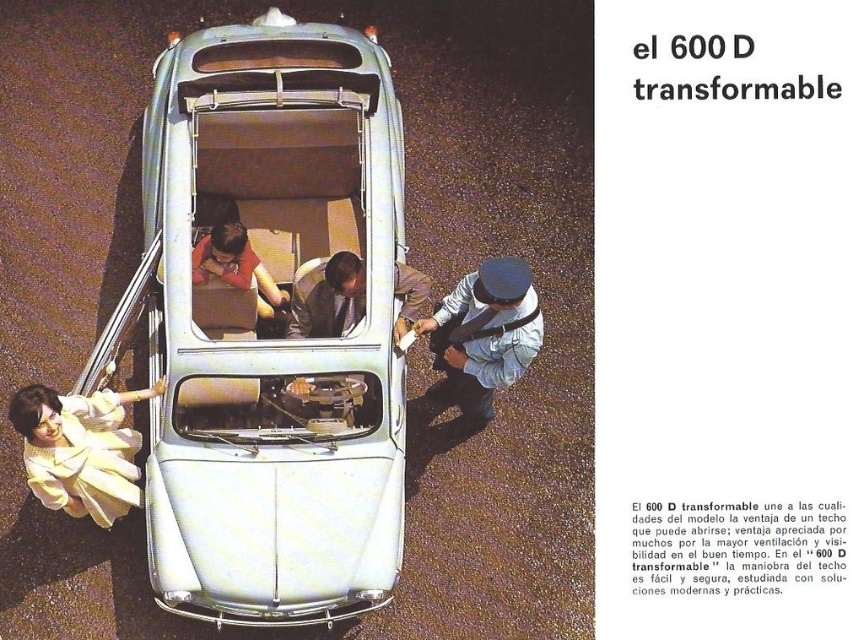
Can you confirm if light yellow fabric at lower left is taller than light brown leather jacket at center?

Yes.

Does light yellow fabric at lower left lie behind light brown leather jacket at center?

No, light yellow fabric at lower left is in front of light brown leather jacket at center.

Is point (62, 429) farther from camera compared to point (397, 330)?

No, (62, 429) is in front of (397, 330).

Find the location of a particular element. The width and height of the screenshot is (864, 640). light yellow fabric at lower left is located at coordinates (80, 449).

Which of these two, light blue denim jacket at center or light brown leather jacket at center, stands shorter?

light brown leather jacket at center

Does point (477, 388) come farther from viewer compared to point (429, 285)?

Yes, it is behind point (429, 285).

Locate an element on the screen. light blue denim jacket at center is located at coordinates (483, 333).

Does silver metallic car at center have a greater height compared to light yellow fabric at lower left?

Yes.

Is point (198, 396) closer to camera compared to point (110, 486)?

Yes.

The height and width of the screenshot is (640, 864). Identify the location of silver metallic car at center. (265, 337).